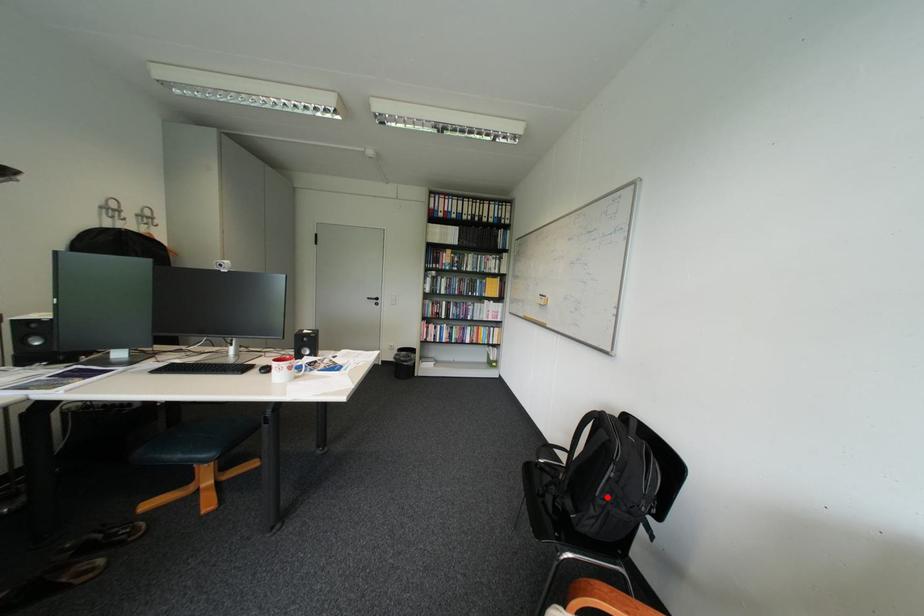
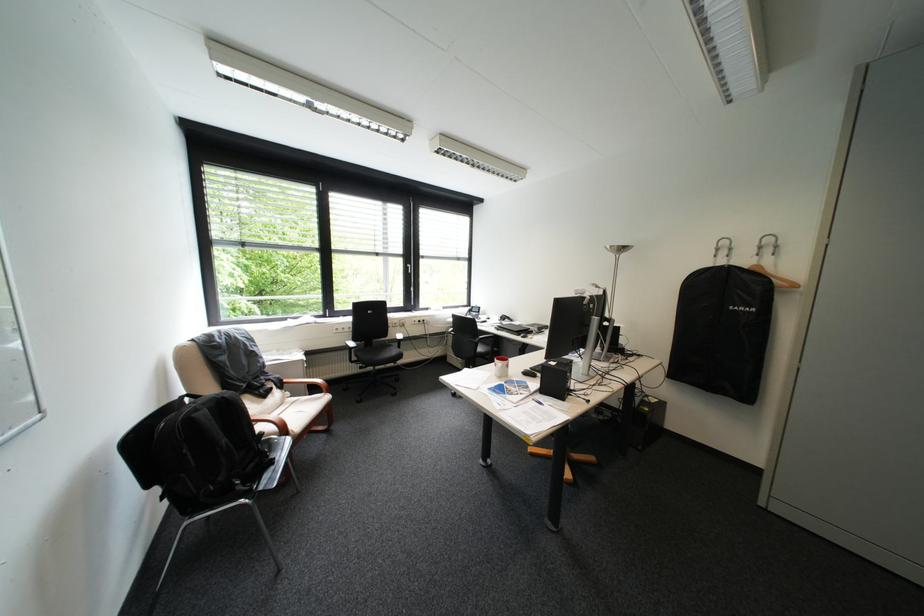
In the second image, find the point that corresponds to the highlighted location in the first image.

(254, 427)